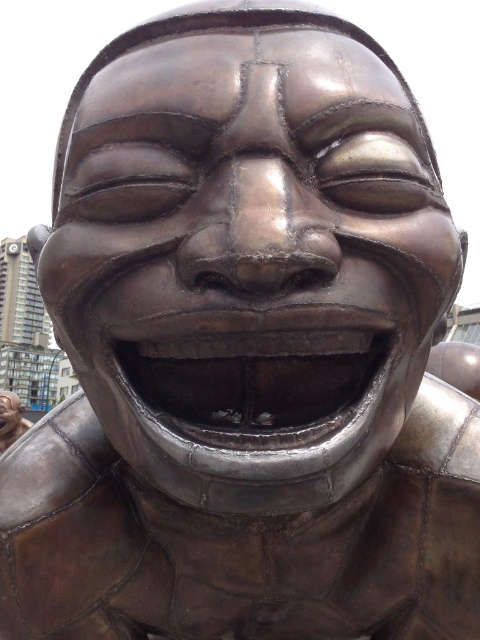
Question: Can you confirm if shiny metallic mouth at center is positioned above bronze statue at lower left?

Choices:
 (A) yes
 (B) no

Answer: (A)

Question: Among these objects, which one is nearest to the camera?

Choices:
 (A) bronze statue at lower left
 (B) shiny metallic mouth at center

Answer: (B)

Question: Does shiny metallic mouth at center lie behind bronze statue at lower left?

Choices:
 (A) no
 (B) yes

Answer: (A)

Question: Is shiny metallic mouth at center to the left of bronze statue at lower left from the viewer's perspective?

Choices:
 (A) yes
 (B) no

Answer: (B)

Question: Which of the following is the closest to the observer?

Choices:
 (A) bronze statue at lower left
 (B) shiny metallic mouth at center

Answer: (B)